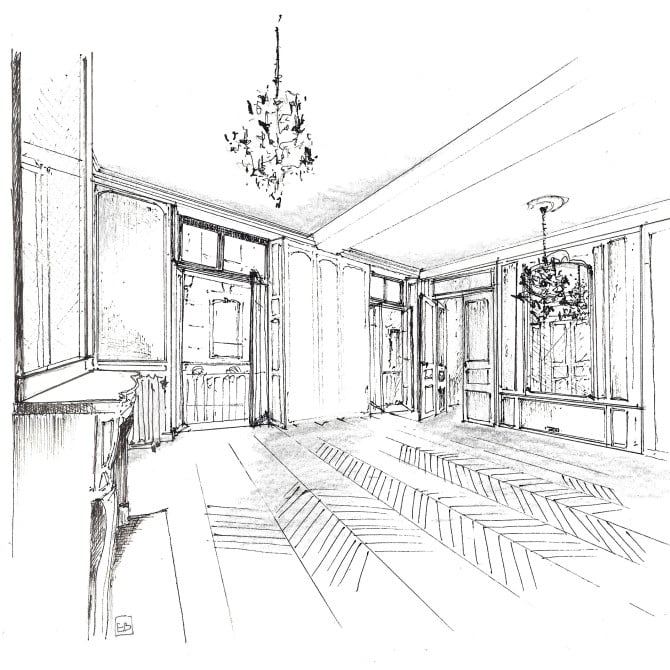
This screenshot has height=670, width=670. I want to click on doors on right, so click(482, 394), click(427, 392).